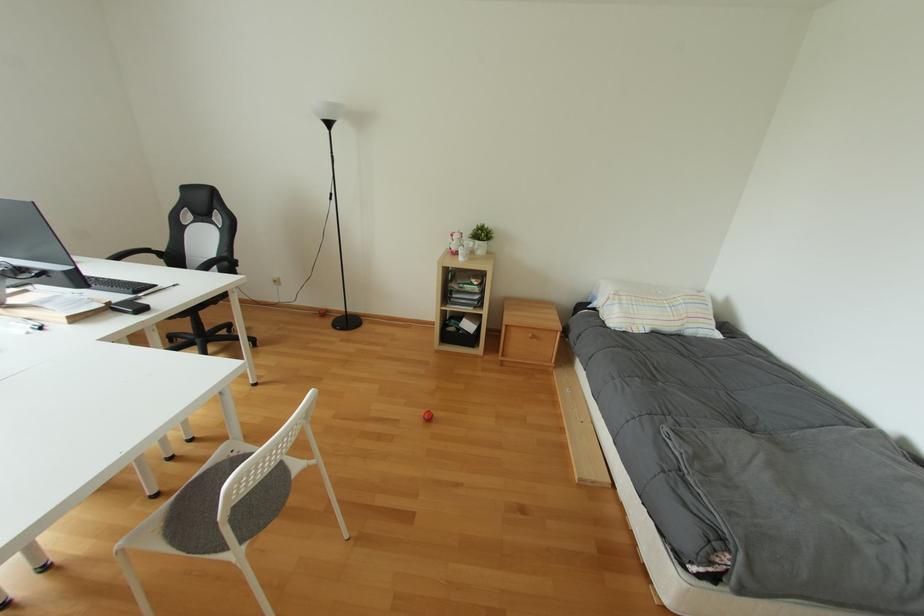
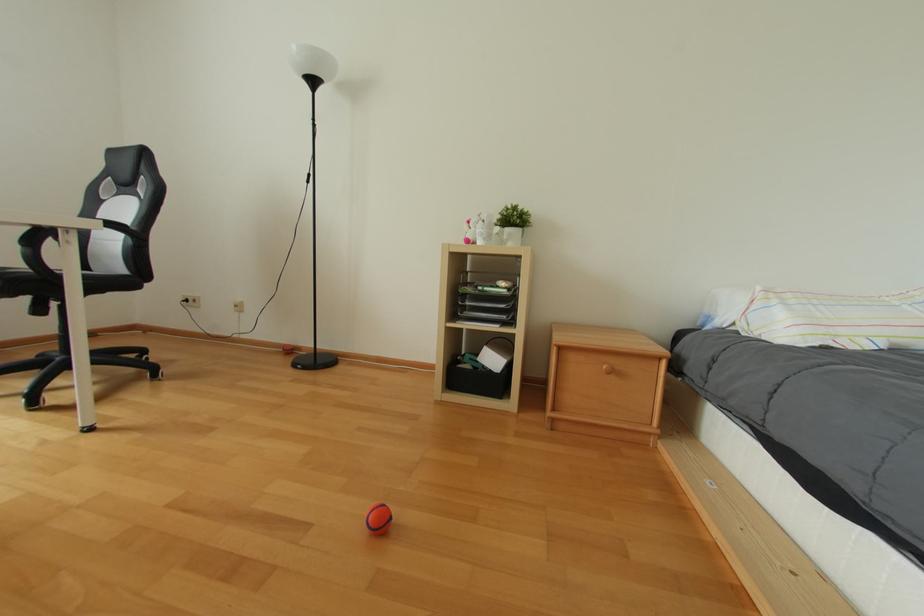
Question: The images are taken continuously from a first-person perspective. In which direction are you moving?

Choices:
 (A) Left
 (B) Right
 (C) Forward
 (D) Backward

Answer: (C)